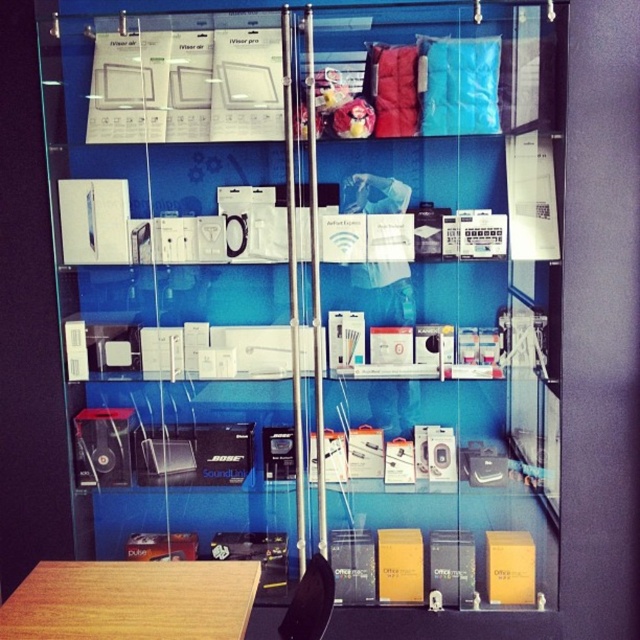
Is transparent plastic glass door at upper center above wooden table at lower left?

Yes.

Between transparent plastic glass door at upper center and wooden table at lower left, which one has more height?

Standing taller between the two is transparent plastic glass door at upper center.

At what (x,y) coordinates should I click in order to perform the action: click on transparent plastic glass door at upper center. Please return your answer as a coordinate pair (x, y). This screenshot has width=640, height=640. Looking at the image, I should click on (438, 317).

Where is `transparent plastic glass door at upper center`? The image size is (640, 640). transparent plastic glass door at upper center is located at coordinates (438, 317).